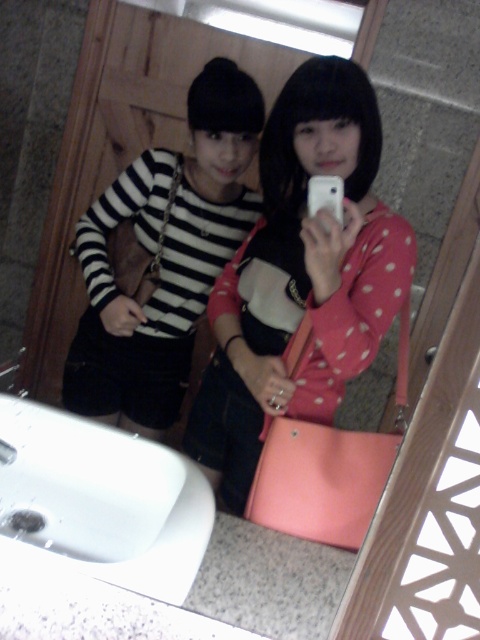
Between point (335, 140) and point (332, 196), which one is positioned in front?

Positioned in front is point (332, 196).

Between pink matte handbag at center and white matte smartphone at center, which one has more height?

pink matte handbag at center is taller.

What do you see at coordinates (300, 276) in the screenshot? The image size is (480, 640). I see `pink matte handbag at center` at bounding box center [300, 276].

Where is `pink matte handbag at center`? The height and width of the screenshot is (640, 480). pink matte handbag at center is located at coordinates (300, 276).

Which is more to the right, pink matte handbag at center or white glossy sink at lower left?

pink matte handbag at center

Is point (295, 417) in front of point (126, 547)?

No.

The width and height of the screenshot is (480, 640). Identify the location of pink matte handbag at center. (300, 276).

Based on the photo, is striped fabric shirt at center shorter than white glossy sink at lower left?

No.

The width and height of the screenshot is (480, 640). What do you see at coordinates (164, 257) in the screenshot? I see `striped fabric shirt at center` at bounding box center [164, 257].

Where is `striped fabric shirt at center`? The width and height of the screenshot is (480, 640). striped fabric shirt at center is located at coordinates click(x=164, y=257).